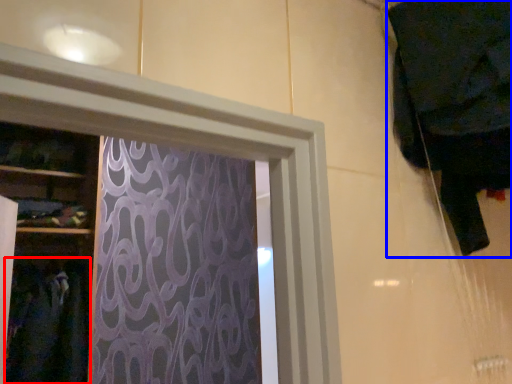
Question: Which point is closer to the camera, clothing (highlighted by a red box) or clothing (highlighted by a blue box)?

Choices:
 (A) clothing
 (B) clothing

Answer: (B)